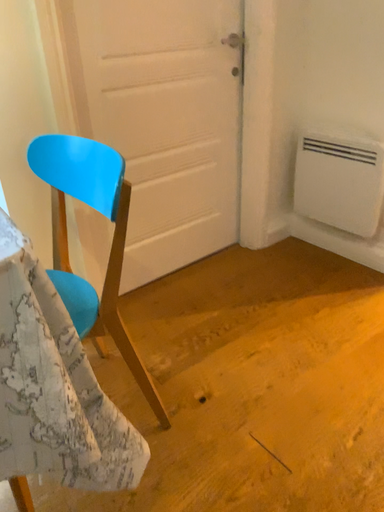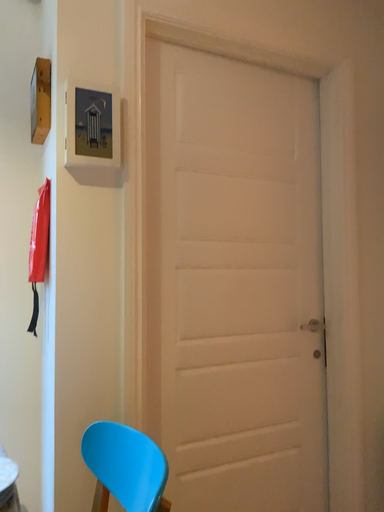
Question: How did the camera likely rotate when shooting the video?

Choices:
 (A) rotated left
 (B) rotated right

Answer: (A)